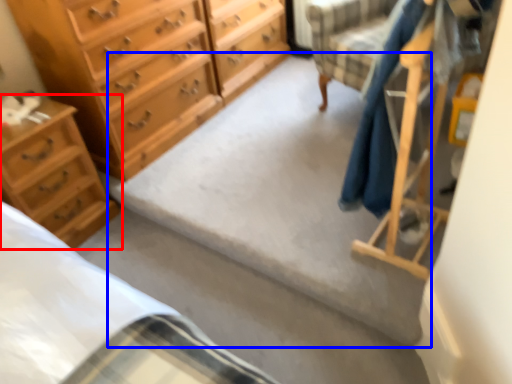
Question: Which object appears closest to the camera in this image, chest of drawers (highlighted by a red box) or concrete (highlighted by a blue box)?

Choices:
 (A) chest of drawers
 (B) concrete

Answer: (B)